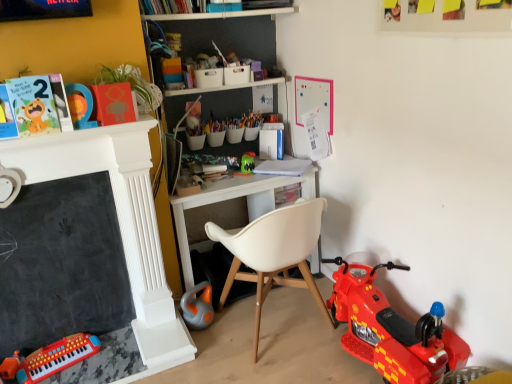
Image resolution: width=512 pixels, height=384 pixels. Identify the location of vacant area that is in front of orange plastic toy at lower center, which ranks as the fourth toy in left-to-right order. [212, 342].